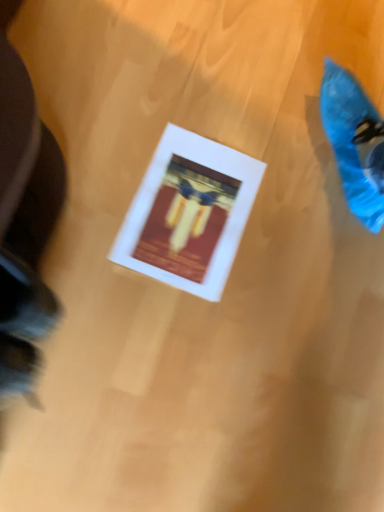
The image size is (384, 512). In order to click on vacant space behind white matte picture frame at center in this screenshot , I will do `click(246, 116)`.